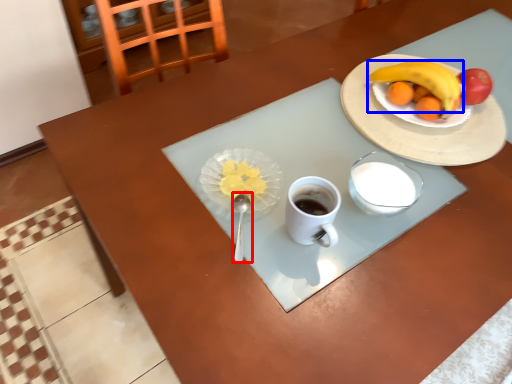
Question: Which object appears closest to the camera in this image, utensil (highlighted by a red box) or banana (highlighted by a blue box)?

Choices:
 (A) utensil
 (B) banana

Answer: (A)